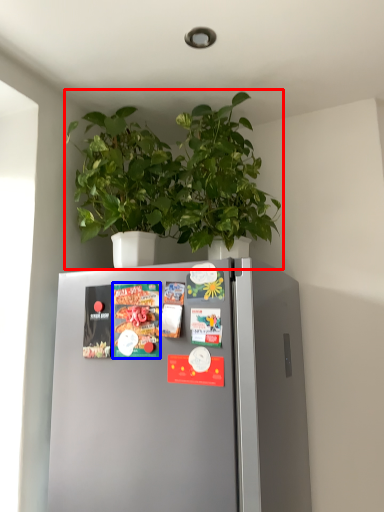
Question: Among these objects, which one is nearest to the camera, houseplant (highlighted by a red box) or magazine (highlighted by a blue box)?

Choices:
 (A) houseplant
 (B) magazine

Answer: (A)